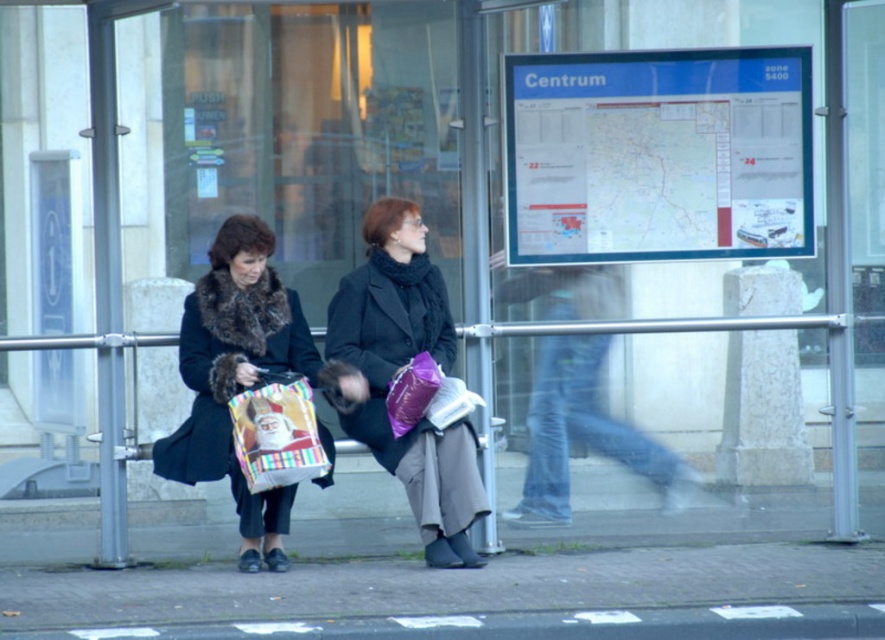
In the scene shown: You are a delivery person trying to deliver a package to the bus stop. You see a matte black coat at center and a matte plastic bag at center. Which item is bigger in size?

The matte black coat at center is larger in size compared to the matte plastic bag at center.

Based on the photo, you are a delivery person trying to locate the gift bag at lower left. The gift bag is on the left side of the bench. You see a point marked at coordinate (399, 371). Is this point on the gift bag or on the matte black coat at center?

The point at coordinate (399, 371) is on the matte black coat at center, so it is not on the gift bag at lower left.